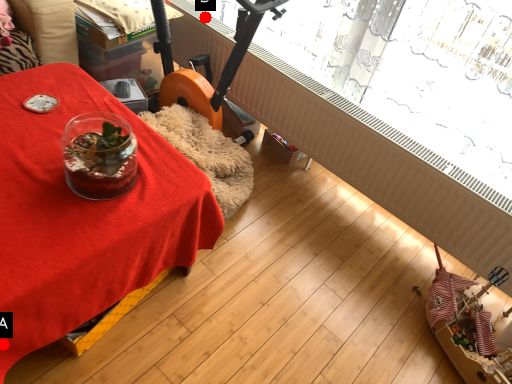
Question: Two points are circled on the image, labeled by A and B beside each circle. Which point is further to the camera?

Choices:
 (A) A is further
 (B) B is further

Answer: (B)